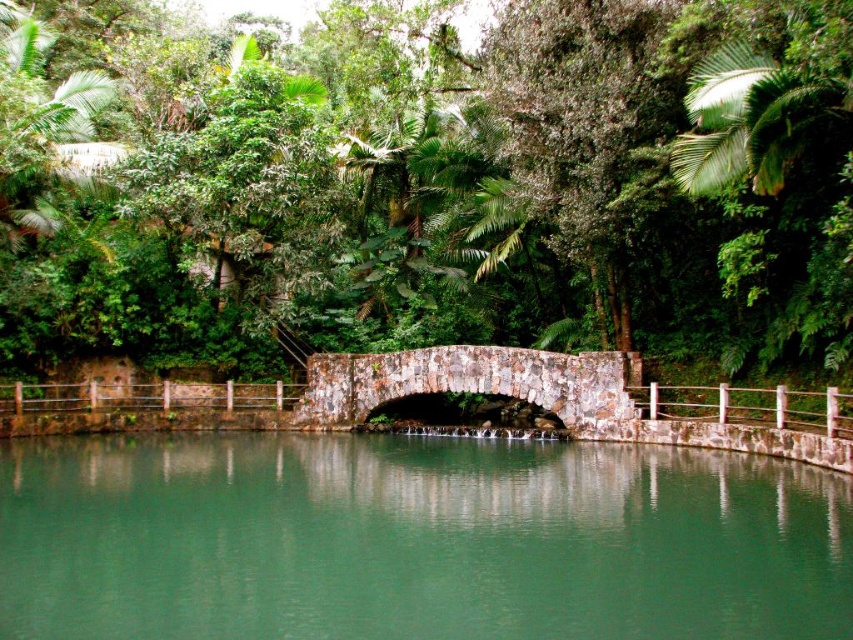
You are an artist planning to paint the scene. You want to ensure the green stone river at center and the green leafy tree at upper right are proportionally accurate. Which object should you paint larger in your artwork?

The green stone river at center should be painted larger than the green leafy tree at upper right because it is larger in size according to the description.

You are standing on the rustic stone bridge at center and looking towards the green leafy tree at upper right. Is the tree located above or below the bridge in your field of view?

The green leafy tree at upper right is above the rustic stone bridge at center, so it is located above the bridge in your field of view.

You are standing at the center of the rustic stone bridge at the center. Looking towards the upper right corner of the image, can you see the green leafy tree at upper right?

Yes, the green leafy tree at upper right is located at point (781, 166), which is in the upper right corner of the image, so you can see it from the center of the rustic stone bridge at the center.